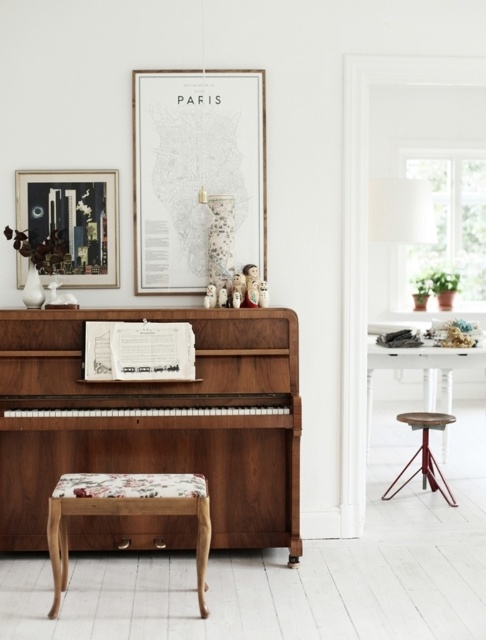
You are standing in the room and want to place a new lamp on the floor at the point marked as point (x=113, y=528). If the lamp requires a 5 meter clearance from the viewer to avoid blocking the view of the piano, will placing it there be suitable?

The distance of point (x=113, y=528) from viewer is 4.55 meters, which is less than the required 5 meter clearance. Placing the lamp there would block the view of the piano.

You are an interior designer assessing the space. You need to determine if the wooden picture frame at upper center can be placed on a shelf that can only hold items smaller than the floral fabric stool at lower center. Can it fit?

The wooden picture frame at upper center is smaller than the floral fabric stool at lower center, so it can fit on the shelf designed for items smaller than the floral fabric stool at lower center.

You are planning to move the wooden picture frame at upper center to the right side of the shiny walnut piano at center. Based on their sizes, will the frame fit entirely on the piano without overlapping the edges?

The shiny walnut piano at center is wider than the wooden picture frame at upper center. Therefore, the wooden picture frame at upper center will fit entirely on the piano without overlapping the edges.